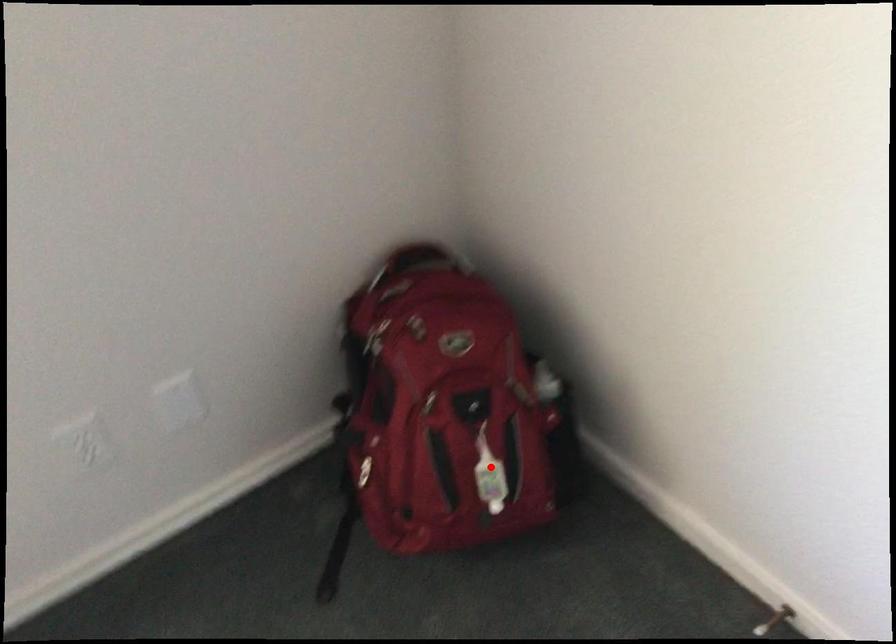
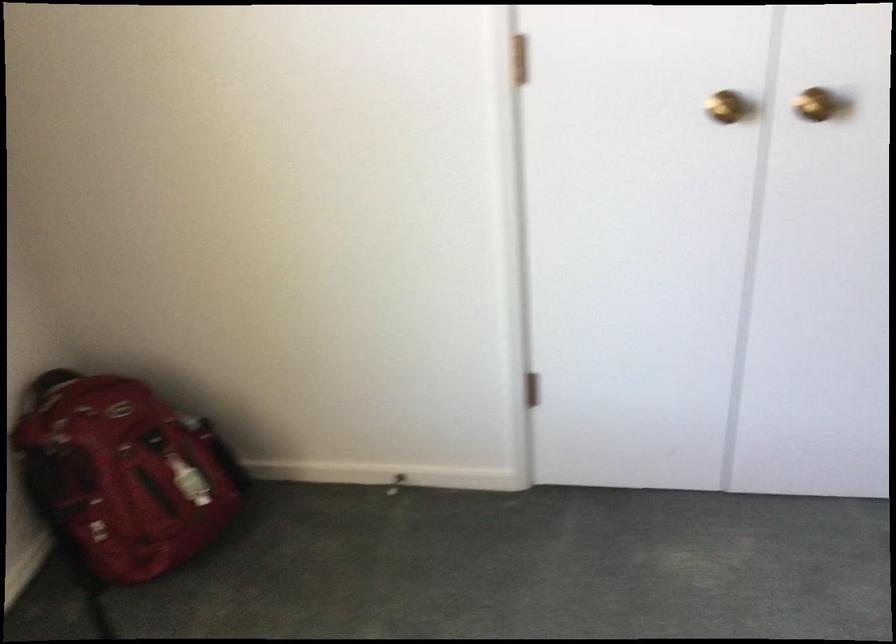
Find the pixel in the second image that matches the highlighted location in the first image.

(188, 480)